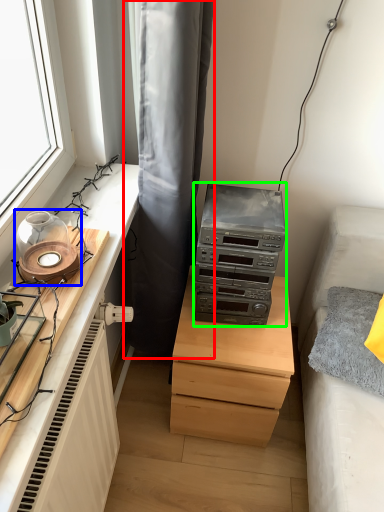
Question: Considering the real-world distances, which object is closest to curtain (highlighted by a red box)? candle holder (highlighted by a blue box) or stereo (highlighted by a green box).

Choices:
 (A) candle holder
 (B) stereo

Answer: (B)